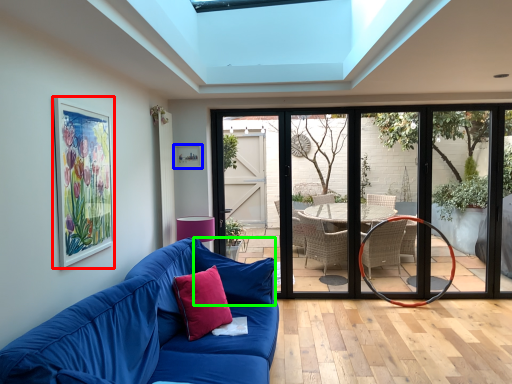
Question: Based on their relative distances, which object is farther from picture frame (highlighted by a red box)? Choose from picture frame (highlighted by a blue box) and pillow (highlighted by a green box).

Choices:
 (A) picture frame
 (B) pillow

Answer: (A)